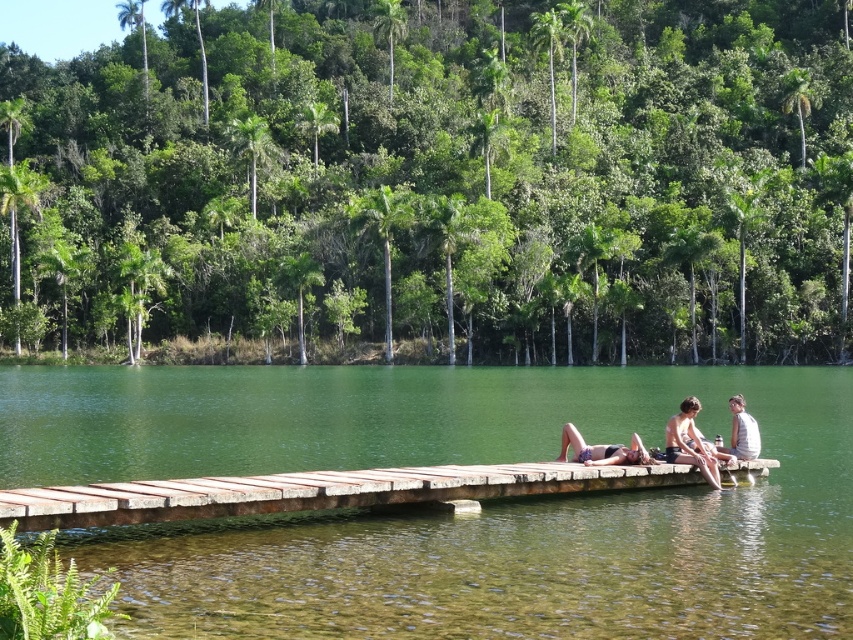
Question: Considering the relative positions of weathered wood dock at center and beige fabric towel at center in the image provided, where is weathered wood dock at center located with respect to beige fabric towel at center?

Choices:
 (A) left
 (B) right

Answer: (A)

Question: In this image, where is matte white skin at center located relative to gray cotton shirt at right?

Choices:
 (A) above
 (B) below

Answer: (B)

Question: Can you confirm if green translucent water at center is thinner than weathered wood dock at center?

Choices:
 (A) no
 (B) yes

Answer: (A)

Question: Which of the following is the closest to the observer?

Choices:
 (A) beige fabric towel at center
 (B) green translucent water at center

Answer: (B)

Question: Estimate the real-world distances between objects in this image. Which object is farther from the beige fabric towel at center?

Choices:
 (A) matte skin couple at center
 (B) green translucent water at center

Answer: (B)

Question: Which point is farther to the camera?

Choices:
 (A) matte skin couple at center
 (B) green translucent water at center
 (C) gray cotton shirt at right

Answer: (C)